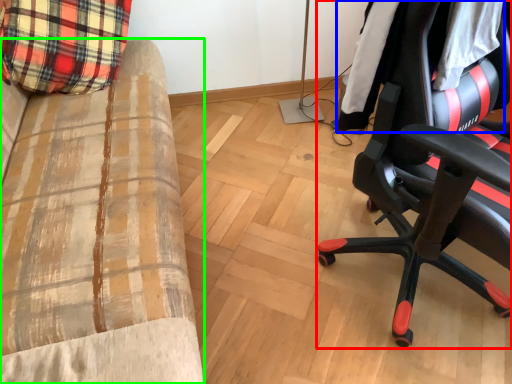
Question: Which object is the farthest from chair (highlighted by a red box)? Choose among these: clothing (highlighted by a blue box) or furniture (highlighted by a green box).

Choices:
 (A) clothing
 (B) furniture

Answer: (B)